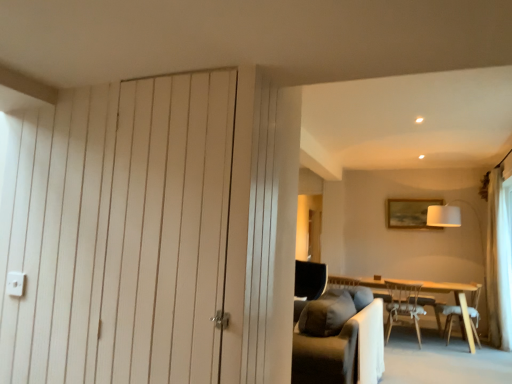
Describe the element at coordinates (498, 264) in the screenshot. I see `white sheer curtain at right` at that location.

Measure the distance between light wood table at center and camera.

The depth of light wood table at center is 17.03 feet.

Image resolution: width=512 pixels, height=384 pixels. I want to click on white wood door at left, so click(x=120, y=233).

What do you see at coordinates (448, 317) in the screenshot? Image resolution: width=512 pixels, height=384 pixels. I see `wooden chair at lower right, marked as the first chair in a right-to-left arrangement` at bounding box center [448, 317].

The image size is (512, 384). What do you see at coordinates (409, 213) in the screenshot?
I see `wooden framed picture at upper right` at bounding box center [409, 213].

You are a GUI agent. You are given a task and a screenshot of the screen. Output one action in this format:
    pyautogui.click(x=<x>, y=<y>)
    Task: Click on the light brown wooden chair at lower right, the 1th chair viewed from the left
    The image size is (512, 384).
    Given the screenshot: What is the action you would take?
    pyautogui.click(x=405, y=306)

Find the location of a particular element. white sheer curtain at right is located at coordinates (498, 264).

Is white sheer curtain at right wider or thinner than light wood table at center?

Clearly, white sheer curtain at right has less width compared to light wood table at center.

Which of these two, white sheer curtain at right or light wood table at center, stands taller?

With more height is white sheer curtain at right.

Based on the photo, is white sheer curtain at right positioned far away from light wood table at center?

They are positioned close to each other.

From a real-world perspective, which is physically above, white sheer curtain at right or light wood table at center?

white sheer curtain at right, from a real-world perspective.

Find the location of a particular element. This screenshot has width=512, height=384. table lamp above the light wood table at center (from the image's perspective) is located at coordinates (444, 216).

Which of these two, white fabric lampshade at upper right or light wood table at center, is smaller?

Smaller between the two is light wood table at center.

Is point (444, 220) closer or farther from the camera than point (458, 294)?

Clearly, point (444, 220) is more distant from the camera than point (458, 294).

Considering the relative sizes of white fabric lampshade at upper right and light wood table at center in the image provided, is white fabric lampshade at upper right wider than light wood table at center?

Yes.

In the scene shown: Is white wood door at left further to the viewer compared to light brown wooden chair at lower right, which is counted as the second chair, starting from the right?

No, white wood door at left is in front of light brown wooden chair at lower right, which is counted as the second chair, starting from the right.

Is white wood door at left to the left or to the right of light brown wooden chair at lower right, the 1th chair viewed from the left, in the image?

white wood door at left is to the left of light brown wooden chair at lower right, the 1th chair viewed from the left.

Is white wood door at left spatially inside light brown wooden chair at lower right, the 1th chair viewed from the left, or outside of it?

white wood door at left is located beyond the bounds of light brown wooden chair at lower right, the 1th chair viewed from the left.

Does white wood door at left have a greater height compared to light brown wooden chair at lower right, the 1th chair viewed from the left?

Yes.

From the image's perspective, between wooden framed picture at upper right and white sheer curtain at right, which one is located above?

From the image's view, wooden framed picture at upper right is above.

From a real-world perspective, which is physically below, wooden framed picture at upper right or white sheer curtain at right?

From a 3D spatial view, white sheer curtain at right is below.

Can you see wooden framed picture at upper right touching white sheer curtain at right?

There is a gap between wooden framed picture at upper right and white sheer curtain at right.

Which is more distant, [463,328] or [434,219]?

The point [434,219] is more distant.

How many degrees apart are the facing directions of light wood table at center and white fabric lampshade at upper right?

The angular difference between light wood table at center and white fabric lampshade at upper right is 2.16 degrees.

Is light wood table at center oriented away from white fabric lampshade at upper right?

No, light wood table at center's orientation is not away from white fabric lampshade at upper right.

Is light wood table at center placed right next to white fabric lampshade at upper right?

light wood table at center and white fabric lampshade at upper right are clearly separated.

Considering the sizes of objects light brown wooden chair at lower right, which is counted as the second chair, starting from the right, and white fabric lampshade at upper right in the image provided, who is wider, light brown wooden chair at lower right, which is counted as the second chair, starting from the right, or white fabric lampshade at upper right?

Wider between the two is white fabric lampshade at upper right.

From a real-world perspective, relative to white fabric lampshade at upper right, is light brown wooden chair at lower right, which is counted as the second chair, starting from the right, vertically above or below?

Clearly, from a real-world perspective, light brown wooden chair at lower right, which is counted as the second chair, starting from the right, is below white fabric lampshade at upper right.

Is there a large distance between light brown wooden chair at lower right, which is counted as the second chair, starting from the right, and white fabric lampshade at upper right?

Yes.

From the image's perspective, which is below, light brown wooden chair at lower right, the 1th chair viewed from the left, or white fabric lampshade at upper right?

light brown wooden chair at lower right, the 1th chair viewed from the left, appears lower in the image.

From the image's perspective, relative to white wood door at left, is wooden framed picture at upper right above or below?

Clearly, from the image's perspective, wooden framed picture at upper right is below white wood door at left.

Which object is positioned more to the right, wooden framed picture at upper right or white wood door at left?

wooden framed picture at upper right.

Can you confirm if wooden framed picture at upper right is wider than white wood door at left?

Correct, the width of wooden framed picture at upper right exceeds that of white wood door at left.

The image size is (512, 384). In order to click on curtain above the light wood table at center (from a real-world perspective) in this screenshot , I will do `click(498, 264)`.

Identify the location of table that appears below the white fabric lampshade at upper right (from the image's perspective). Image resolution: width=512 pixels, height=384 pixels. (428, 292).

Which object lies further to the anchor point white wood door at left, light wood table at center or light brown wooden chair at lower right, which is counted as the second chair, starting from the right?

The object further to white wood door at left is light brown wooden chair at lower right, which is counted as the second chair, starting from the right.

From the image, which object appears to be farther from light wood table at center, white sheer curtain at right or wooden chair at lower right, marked as the first chair in a right-to-left arrangement?

The object further to light wood table at center is white sheer curtain at right.

Estimate the real-world distances between objects in this image. Which object is closer to light brown wooden chair at lower right, the 1th chair viewed from the left, wooden chair at lower right, which is counted as the second chair, starting from the left, or white sheer curtain at right?

wooden chair at lower right, which is counted as the second chair, starting from the left, is closer to light brown wooden chair at lower right, the 1th chair viewed from the left.

When comparing their distances from light brown wooden chair at lower right, the 1th chair viewed from the left, does wooden framed picture at upper right or wooden chair at lower right, marked as the first chair in a right-to-left arrangement, seem closer?

The object closer to light brown wooden chair at lower right, the 1th chair viewed from the left, is wooden chair at lower right, marked as the first chair in a right-to-left arrangement.

From the image, which object appears to be farther from wooden chair at lower right, which is counted as the second chair, starting from the left, white wood door at left or light brown wooden chair at lower right, the 1th chair viewed from the left?

Among the two, white wood door at left is located further to wooden chair at lower right, which is counted as the second chair, starting from the left.

Based on their spatial positions, is wooden framed picture at upper right or light wood table at center further from white sheer curtain at right?

Among the two, wooden framed picture at upper right is located further to white sheer curtain at right.

Considering their positions, is white fabric lampshade at upper right positioned further to white wood door at left than light brown wooden chair at lower right, which is counted as the second chair, starting from the right?

Among the two, white fabric lampshade at upper right is located further to white wood door at left.

In the scene shown: Looking at the image, which one is located closer to wooden chair at lower right, which is counted as the second chair, starting from the left, white sheer curtain at right or white fabric lampshade at upper right?

Based on the image, white sheer curtain at right appears to be nearer to wooden chair at lower right, which is counted as the second chair, starting from the left.

Where is `curtain located between white wood door at left and wooden framed picture at upper right in the depth direction`? curtain located between white wood door at left and wooden framed picture at upper right in the depth direction is located at coordinates (498, 264).

Where is `table lamp between light wood table at center and white sheer curtain at right`? Image resolution: width=512 pixels, height=384 pixels. table lamp between light wood table at center and white sheer curtain at right is located at coordinates [444, 216].

Locate an element on the screen. table positioned between white wood door at left and white fabric lampshade at upper right from near to far is located at coordinates (428, 292).

Where is `curtain between light brown wooden chair at lower right, the 1th chair viewed from the left, and wooden framed picture at upper right, along the z-axis`? curtain between light brown wooden chair at lower right, the 1th chair viewed from the left, and wooden framed picture at upper right, along the z-axis is located at coordinates (498, 264).